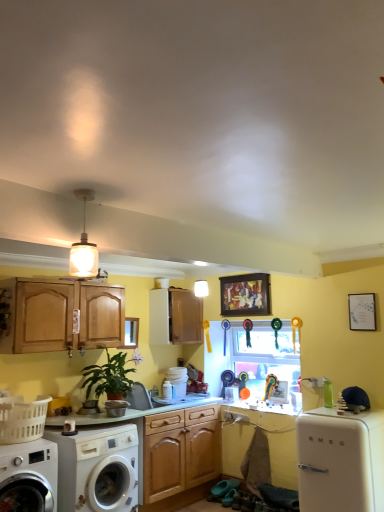
Question: Is white glossy refrigerator at lower right taller or shorter than white glossy washing machine at lower left, positioned as the 2th washing machine in left-to-right order?

Choices:
 (A) short
 (B) tall

Answer: (B)

Question: From the image's perspective, relative to white glossy washing machine at lower left, positioned as the 1th washing machine in right-to-left order, is white glossy refrigerator at lower right above or below?

Choices:
 (A) below
 (B) above

Answer: (B)

Question: Based on their relative distances, which object is farther from the white glossy washing machine at lower left, positioned as the 2th washing machine in left-to-right order?

Choices:
 (A) white glossy refrigerator at lower right
 (B) wooden framed artwork at upper center
 (C) clear glass window screen at center
 (D) green matte countertop at center
 (E) green matte plant at lower left

Answer: (B)

Question: Considering the real-world distances, which object is farthest from the matte wood cabinet at center?

Choices:
 (A) white glossy refrigerator at lower right
 (B) green matte countertop at center
 (C) wooden framed artwork at upper center
 (D) white plastic laundry basket at lower left
 (E) metallic silver washing machine at lower left

Answer: (A)